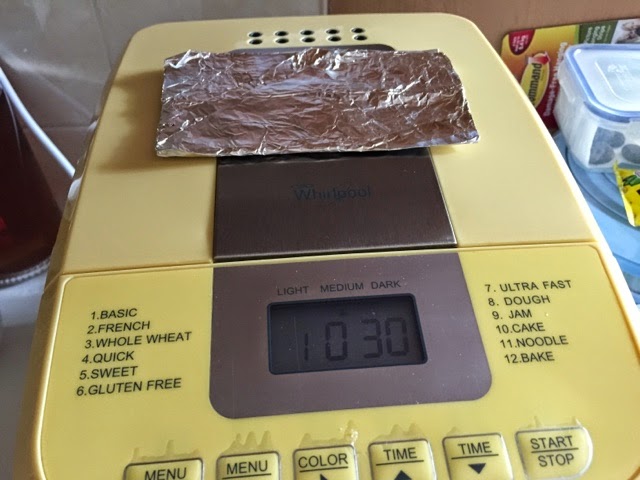
You are a GUI agent. You are given a task and a screenshot of the screen. Output one action in this format:
    pyautogui.click(x=<x>, y=<y>)
    Task: Click on the display
    The height and width of the screenshot is (480, 640).
    Given the screenshot: What is the action you would take?
    pyautogui.click(x=314, y=355)